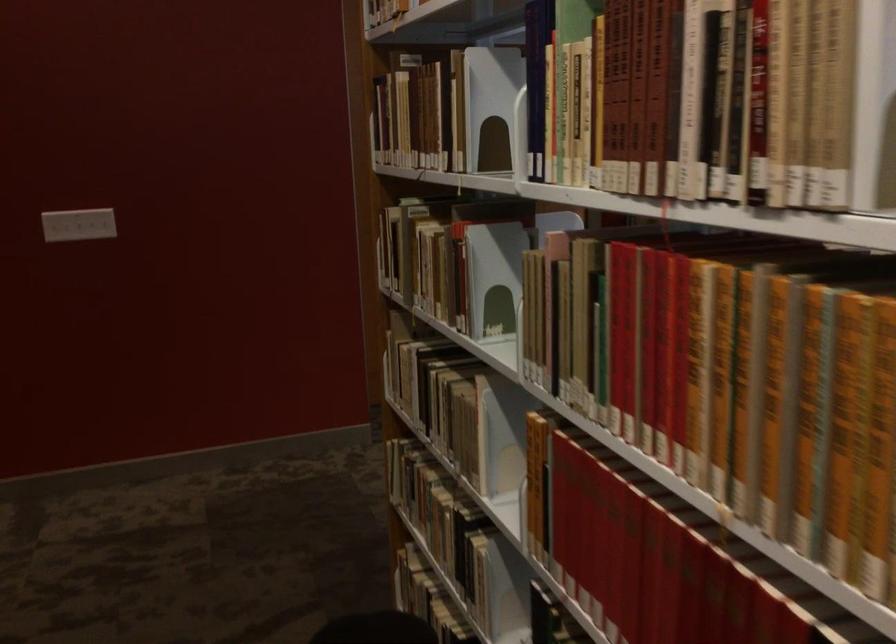
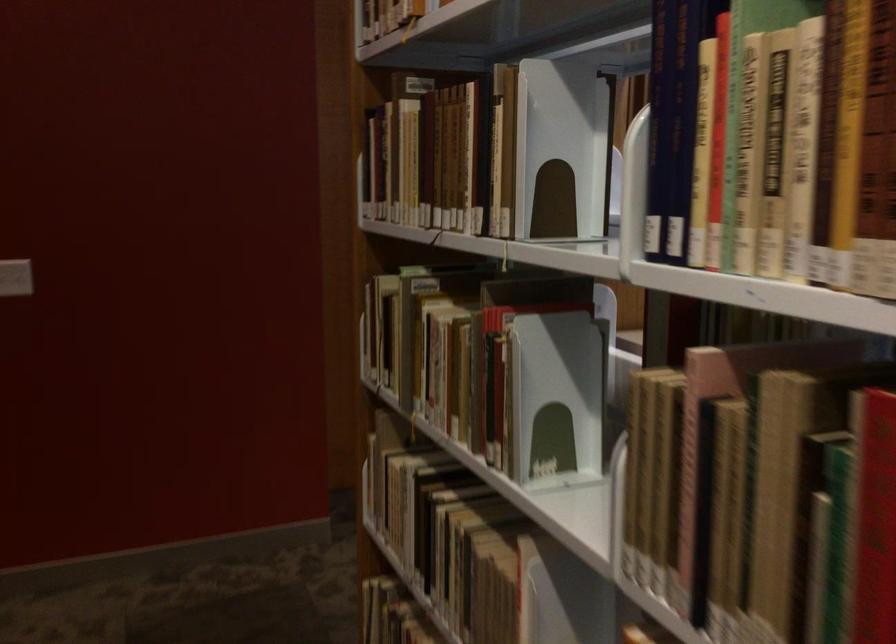
In the second image, find the point that corresponds to pixel 498 109 in the first image.

(561, 149)